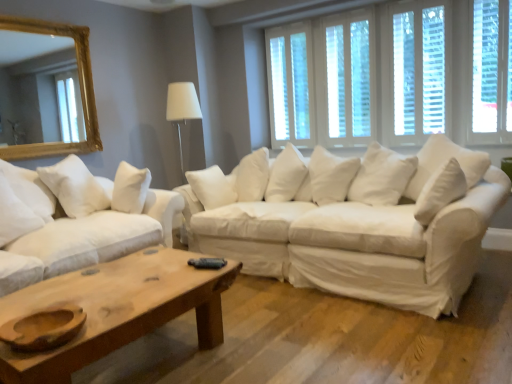
Question: Does white wood window at upper center, which is the first window from left to right, appear on the left side of white soft pillow at left?

Choices:
 (A) yes
 (B) no

Answer: (B)

Question: Is white wood window at upper center, the fourth window when ordered from right to left, completely or partially outside of white soft pillow at left?

Choices:
 (A) no
 (B) yes

Answer: (B)

Question: Considering the relative sizes of white wood window at upper center, which is the first window from left to right, and white soft pillow at left in the image provided, is white wood window at upper center, which is the first window from left to right, smaller than white soft pillow at left?

Choices:
 (A) no
 (B) yes

Answer: (B)

Question: Can you confirm if white wood window at upper center, the fourth window when ordered from right to left, is bigger than white soft pillow at left?

Choices:
 (A) no
 (B) yes

Answer: (A)

Question: From a real-world perspective, is white wood window at upper center, the fourth window when ordered from right to left, located beneath white soft pillow at left?

Choices:
 (A) yes
 (B) no

Answer: (B)

Question: Is point (397, 132) closer or farther from the camera than point (125, 208)?

Choices:
 (A) closer
 (B) farther

Answer: (B)

Question: From the image's perspective, is white wooden blinds at upper right, arranged as the second window when viewed from the right, located above or below white soft pillow at left?

Choices:
 (A) above
 (B) below

Answer: (A)

Question: In terms of width, does white wooden blinds at upper right, arranged as the second window when viewed from the right, look wider or thinner when compared to white soft pillow at left?

Choices:
 (A) thin
 (B) wide

Answer: (A)

Question: From a real-world perspective, is white wooden blinds at upper right, the 3th window from the left, physically located above or below white soft pillow at left?

Choices:
 (A) below
 (B) above

Answer: (B)

Question: From the image's perspective, is white wooden blinds at upper right, arranged as the second window when viewed from the right, located above or below white wood window at upper center, which is the first window from left to right?

Choices:
 (A) below
 (B) above

Answer: (A)

Question: Considering the positions of point click(x=443, y=82) and point click(x=294, y=107), is point click(x=443, y=82) closer or farther from the camera than point click(x=294, y=107)?

Choices:
 (A) farther
 (B) closer

Answer: (B)

Question: Considering the positions of white wooden blinds at upper right, arranged as the second window when viewed from the right, and white wood window at upper center, the fourth window when ordered from right to left, in the image, is white wooden blinds at upper right, arranged as the second window when viewed from the right, taller or shorter than white wood window at upper center, the fourth window when ordered from right to left,?

Choices:
 (A) short
 (B) tall

Answer: (A)

Question: Is white wooden blinds at upper right, arranged as the second window when viewed from the right, in front of or behind white wood window at upper center, the fourth window when ordered from right to left, in the image?

Choices:
 (A) front
 (B) behind

Answer: (A)

Question: From the image's perspective, relative to white wood window at upper center, the fourth window when ordered from right to left, is white wood window at upper center, positioned as the 2th window in left-to-right order, above or below?

Choices:
 (A) above
 (B) below

Answer: (B)

Question: Would you say white wood window at upper center, positioned as the 3th window in right-to-left order, is to the left or to the right of white wood window at upper center, which is the first window from left to right, in the picture?

Choices:
 (A) right
 (B) left

Answer: (A)